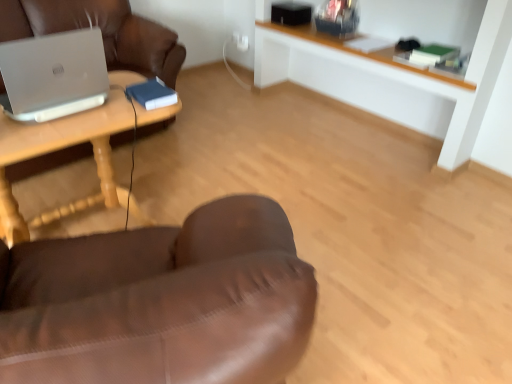
This screenshot has width=512, height=384. What do you see at coordinates (413, 88) in the screenshot? I see `white wood shelf at upper center` at bounding box center [413, 88].

The image size is (512, 384). In order to click on wooden table at left in this screenshot , I will do `click(64, 147)`.

Is the depth of white wood shelf at upper center greater than that of wooden table at left?

Yes.

Are white wood shelf at upper center and wooden table at left located far from each other?

white wood shelf at upper center is positioned a significant distance from wooden table at left.

Considering the sizes of objects white wood shelf at upper center and wooden table at left in the image provided, who is shorter, white wood shelf at upper center or wooden table at left?

With less height is wooden table at left.

From the image's perspective, would you say white wood shelf at upper center is shown under wooden table at left?

Incorrect, from the image's perspective, white wood shelf at upper center is higher than wooden table at left.

From the image's perspective, is silver metallic laptop at left over white wood shelf at upper center?

Actually, silver metallic laptop at left appears below white wood shelf at upper center in the image.

Is silver metallic laptop at left in front of or behind white wood shelf at upper center in the image?

Visually, silver metallic laptop at left is located in front of white wood shelf at upper center.

Is white wood shelf at upper center a part of silver metallic laptop at left?

Actually, white wood shelf at upper center is outside silver metallic laptop at left.

At what (x,y) coordinates should I click in order to perform the action: click on laptop below the white wood shelf at upper center (from the image's perspective). Please return your answer as a coordinate pair (x, y). Looking at the image, I should click on (53, 75).

How different are the orientations of white wood shelf at upper center and silver metallic laptop at left in degrees?

90.2 degrees separate the facing orientations of white wood shelf at upper center and silver metallic laptop at left.

Is white wood shelf at upper center facing towards silver metallic laptop at left?

Yes, white wood shelf at upper center is oriented towards silver metallic laptop at left.

At what (x,y) coordinates should I click in order to perform the action: click on shelf behind the silver metallic laptop at left. Please return your answer as a coordinate pair (x, y). Looking at the image, I should click on (413, 88).

Is white wood shelf at upper center beside silver metallic laptop at left?

No, white wood shelf at upper center is not in contact with silver metallic laptop at left.

Between wooden table at left and white wood shelf at upper center, which one has larger size?

With larger size is white wood shelf at upper center.

Which object is wider, wooden table at left or white wood shelf at upper center?

Wider between the two is wooden table at left.

In the scene shown: Considering the relative sizes of wooden table at left and white wood shelf at upper center in the image provided, is wooden table at left taller than white wood shelf at upper center?

No.

Considering the points (110, 121) and (68, 66), which point is in front, point (110, 121) or point (68, 66)?

The point (68, 66) is more forward.

Does wooden table at left appear on the left side of silver metallic laptop at left?

Correct, you'll find wooden table at left to the left of silver metallic laptop at left.

Which of these two, wooden table at left or silver metallic laptop at left, stands taller?

wooden table at left.

Is the surface of wooden table at left in direct contact with silver metallic laptop at left?

No, wooden table at left is not making contact with silver metallic laptop at left.

Is silver metallic laptop at left next to wooden table at left?

There is a gap between silver metallic laptop at left and wooden table at left.

Is silver metallic laptop at left taller than wooden table at left?

Incorrect, the height of silver metallic laptop at left is not larger of that of wooden table at left.

Considering the points (27, 47) and (100, 162), which point is in front, point (27, 47) or point (100, 162)?

The point (27, 47) is more forward.

Can you confirm if silver metallic laptop at left is positioned to the right of wooden table at left?

Yes, silver metallic laptop at left is to the right of wooden table at left.

The height and width of the screenshot is (384, 512). What are the coordinates of `shelf above the wooden table at left (from a real-world perspective)` in the screenshot? It's located at (413, 88).

This screenshot has height=384, width=512. Identify the location of laptop on the left of white wood shelf at upper center. (53, 75).

Considering their positions, is wooden table at left positioned closer to silver metallic laptop at left than white wood shelf at upper center?

Based on the image, wooden table at left appears to be nearer to silver metallic laptop at left.

From the image, which object appears to be nearer to wooden table at left, white wood shelf at upper center or silver metallic laptop at left?

silver metallic laptop at left is positioned closer to the anchor wooden table at left.

Looking at the image, which one is located further to white wood shelf at upper center, silver metallic laptop at left or wooden table at left?

The object further to white wood shelf at upper center is silver metallic laptop at left.

Which object lies nearer to the anchor point wooden table at left, silver metallic laptop at left or white wood shelf at upper center?

silver metallic laptop at left is closer to wooden table at left.

Which object lies further to the anchor point silver metallic laptop at left, white wood shelf at upper center or wooden table at left?

Among the two, white wood shelf at upper center is located further to silver metallic laptop at left.

When comparing their distances from white wood shelf at upper center, does wooden table at left or silver metallic laptop at left seem closer?

wooden table at left is positioned closer to the anchor white wood shelf at upper center.

Where is `laptop between wooden table at left and white wood shelf at upper center from left to right`? laptop between wooden table at left and white wood shelf at upper center from left to right is located at coordinates (53, 75).